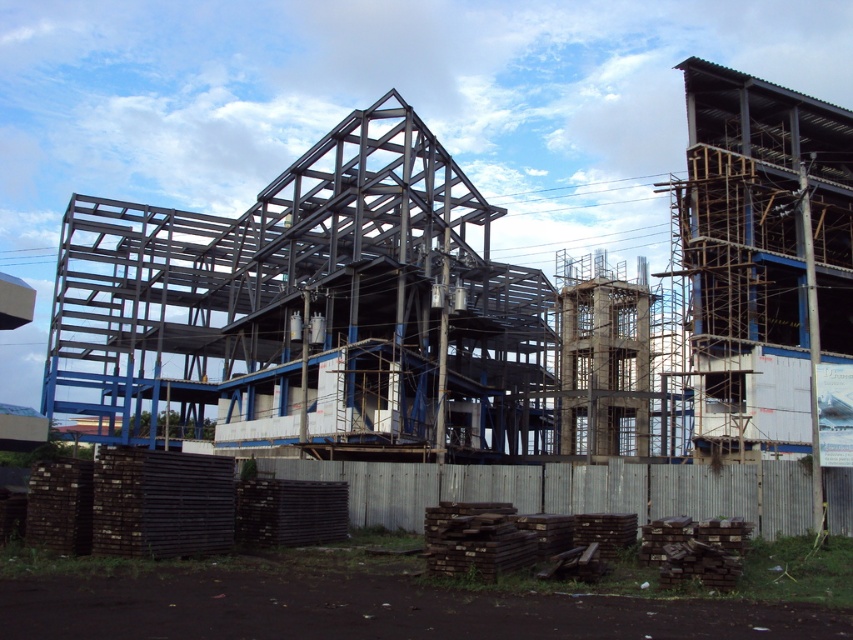
You are a construction worker standing at the entrance of the construction site. You need to locate the metal framework at center. Based on the coordinates provided, can you determine its position relative to the entrance?

The metal framework at center is located at coordinates point (310, 312). Since the entrance is typically positioned at the edge of the site, the framework is centrally positioned within the site, likely towards the middle area between the entrance and the back of the site.

You are a construction worker who needs to transport materials from the gray wood fence at lower center to the metal framework at center. Can you drive a truck through the gap between them?

The metal framework at center might be wider than gray wood fence at lower center, so there is uncertainty about whether the gap is wide enough for a truck. It is safer to measure the gap before attempting to drive through.

You are a construction worker who needs to transport materials from the metal framework at center to the gray wood fence at lower center. Given that your wheelbarrow can carry a maximum load of 50 kg, what is the minimum number of trips required to move 150 kg of materials between them?

The metal framework at center and gray wood fence at lower center are 36.21 meters apart. Since the wheelbarrow can carry 50 kg per trip, moving 150 kg would require 3 trips. However, the distance between them doesn not affect the number of trips as it only depends on the load capacity. Therefore, the minimum number of trips required is 3.